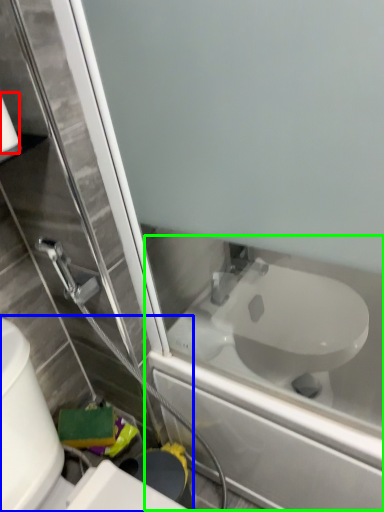
Question: Which object is positioned closest to toilet paper (highlighted by a red box)? Select from toilet (highlighted by a blue box) and bath (highlighted by a green box).

Choices:
 (A) toilet
 (B) bath

Answer: (A)